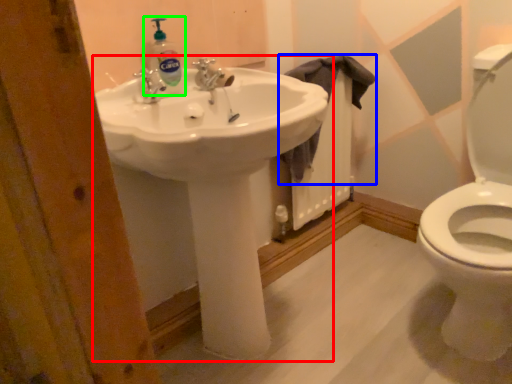
Question: Which object is the closest to the sink (highlighted by a red box)? Choose among these: cloth (highlighted by a blue box) or cleaning product (highlighted by a green box).

Choices:
 (A) cloth
 (B) cleaning product

Answer: (B)